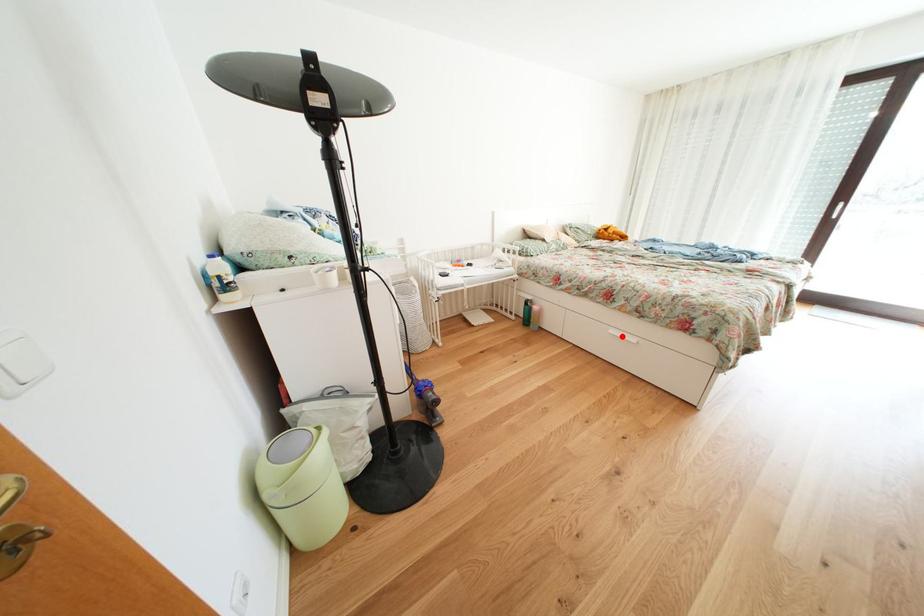
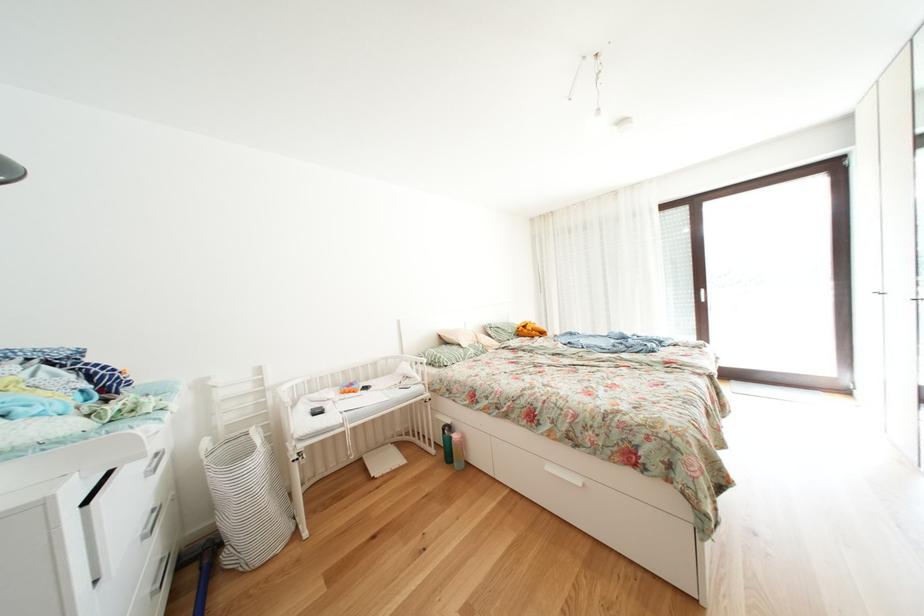
Question: I am providing you with two images of the same scene from different viewpoints. A red point is shown in image1. For the corresponding object point in image2, is it positioned nearer or farther from the camera?

Choices:
 (A) Nearer
 (B) Farther

Answer: (B)